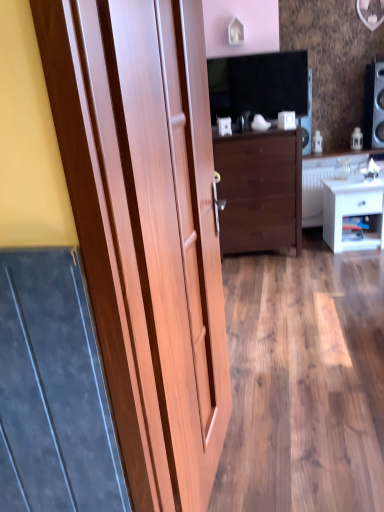
Locate an element on the screen. The image size is (384, 512). blank area to the left of white glossy nightstand at lower right is located at coordinates (312, 247).